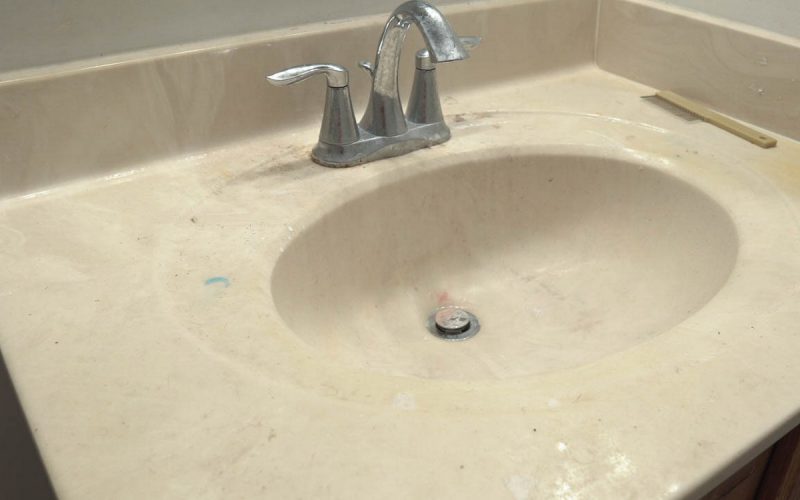
Where is `faucet`? The width and height of the screenshot is (800, 500). faucet is located at coordinates (386, 60).